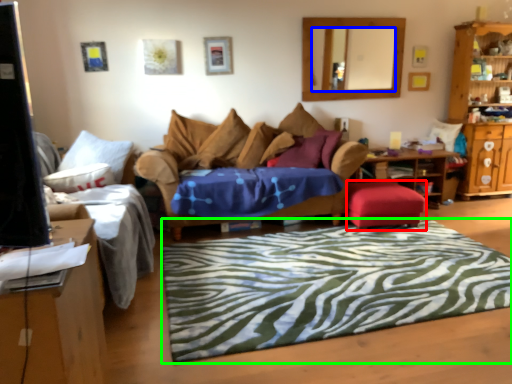
Question: Which object is positioned farthest from stool (highlighted by a red box)? Select from mirror (highlighted by a blue box) and mat (highlighted by a green box).

Choices:
 (A) mirror
 (B) mat

Answer: (A)